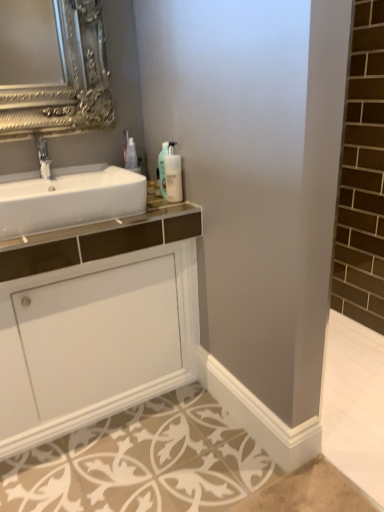
Question: Does translucent plastic soap dispenser at upper center, the 2th soap dispenser from the left, have a larger size compared to white glossy cabinet at center?

Choices:
 (A) yes
 (B) no

Answer: (B)

Question: Considering the relative sizes of translucent plastic soap dispenser at upper center, which is the 1th soap dispenser from right to left, and white glossy cabinet at center in the image provided, is translucent plastic soap dispenser at upper center, which is the 1th soap dispenser from right to left, shorter than white glossy cabinet at center?

Choices:
 (A) no
 (B) yes

Answer: (B)

Question: Is translucent plastic soap dispenser at upper center, which is the 1th soap dispenser from right to left, smaller than white glossy cabinet at center?

Choices:
 (A) yes
 (B) no

Answer: (A)

Question: From the image's perspective, is translucent plastic soap dispenser at upper center, which is the 1th soap dispenser from right to left, above white glossy cabinet at center?

Choices:
 (A) no
 (B) yes

Answer: (B)

Question: Is translucent plastic soap dispenser at upper center, which is the 1th soap dispenser from right to left, further to camera compared to white glossy cabinet at center?

Choices:
 (A) yes
 (B) no

Answer: (A)

Question: Relative to translucent plastic soap dispenser at upper center, the second soap dispenser from the right, is translucent plastic soap dispenser at upper center, which is the 1th soap dispenser from right to left, in front or behind?

Choices:
 (A) front
 (B) behind

Answer: (A)

Question: From the image's perspective, is translucent plastic soap dispenser at upper center, which is the 1th soap dispenser from right to left, positioned above or below translucent plastic soap dispenser at upper center, acting as the first soap dispenser starting from the left?

Choices:
 (A) below
 (B) above

Answer: (A)

Question: Looking at the image, does translucent plastic soap dispenser at upper center, the 2th soap dispenser from the left, seem bigger or smaller compared to translucent plastic soap dispenser at upper center, the second soap dispenser from the right?

Choices:
 (A) small
 (B) big

Answer: (A)

Question: Visually, is translucent plastic soap dispenser at upper center, the 2th soap dispenser from the left, positioned to the left or to the right of translucent plastic soap dispenser at upper center, the second soap dispenser from the right?

Choices:
 (A) left
 (B) right

Answer: (B)

Question: Considering the relative positions of translucent plastic bottle at upper right and white glossy sink at left in the image provided, is translucent plastic bottle at upper right to the left or to the right of white glossy sink at left?

Choices:
 (A) right
 (B) left

Answer: (A)

Question: From a real-world perspective, is translucent plastic bottle at upper right positioned above or below white glossy sink at left?

Choices:
 (A) above
 (B) below

Answer: (A)

Question: Is translucent plastic bottle at upper right situated inside white glossy sink at left or outside?

Choices:
 (A) inside
 (B) outside

Answer: (B)

Question: Looking at the image, does translucent plastic bottle at upper right seem bigger or smaller compared to white glossy sink at left?

Choices:
 (A) big
 (B) small

Answer: (B)

Question: Is point pyautogui.click(x=130, y=350) closer or farther from the camera than point pyautogui.click(x=165, y=146)?

Choices:
 (A) closer
 (B) farther

Answer: (B)

Question: From the image's perspective, is white glossy cabinet at center above or below translucent plastic soap dispenser at upper center, the second soap dispenser from the right?

Choices:
 (A) below
 (B) above

Answer: (A)